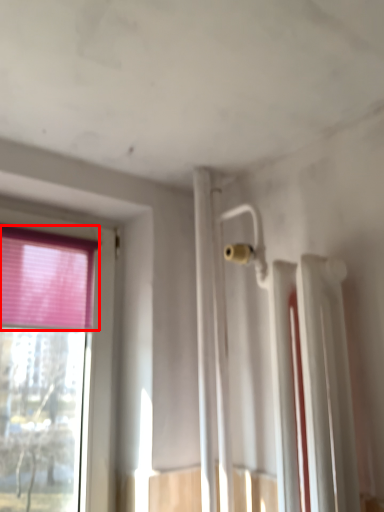
Question: From the image's perspective, where is curtain (annotated by the red box) located relative to radiator?

Choices:
 (A) above
 (B) below

Answer: (A)